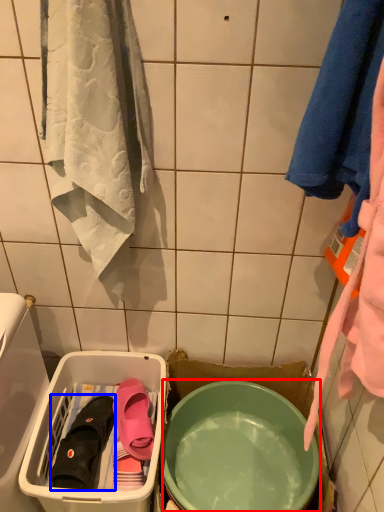
Question: Which point is closer to the camera, mixing bowl (highlighted by a red box) or footwear (highlighted by a blue box)?

Choices:
 (A) mixing bowl
 (B) footwear

Answer: (A)